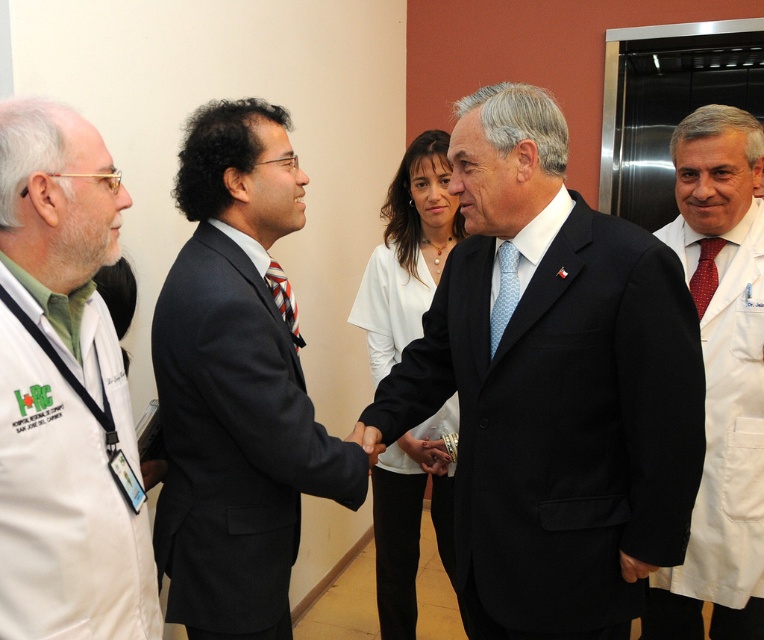
Question: Which point is closer to the camera?

Choices:
 (A) white lab coat at left
 (B) matte black suit at center

Answer: (A)

Question: Which object is closer to the camera taking this photo?

Choices:
 (A) matte black suit at center
 (B) white lab coat at center
 (C) white fabric shirt at center
 (D) white lab coat at right

Answer: (B)

Question: Does white lab coat at center appear on the left side of matte black suit at center?

Choices:
 (A) yes
 (B) no

Answer: (B)

Question: Can you confirm if matte black suit at center is bigger than white fabric shirt at center?

Choices:
 (A) no
 (B) yes

Answer: (A)

Question: Does matte black suit at center appear on the right side of white fabric shirt at center?

Choices:
 (A) no
 (B) yes

Answer: (A)

Question: Based on their relative distances, which object is nearer to the white lab coat at right?

Choices:
 (A) white lab coat at center
 (B) white fabric shirt at center
 (C) matte black suit at center
 (D) white lab coat at left

Answer: (A)